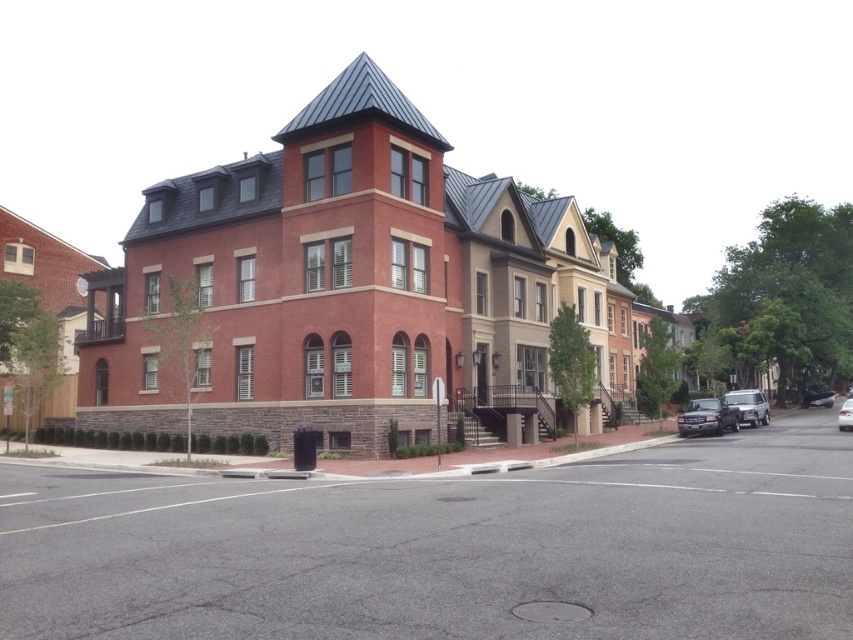
Between metallic silver suv at right and white glossy sedan at center, which one has less height?

Standing shorter between the two is white glossy sedan at center.

Which is in front, point (735, 397) or point (849, 412)?

Point (849, 412)

Locate an element on the screen. Image resolution: width=853 pixels, height=640 pixels. metallic silver suv at right is located at coordinates [x=749, y=404].

Looking at this image, is metallic silver suv at right in front of metallic silver car at right?

Yes, metallic silver suv at right is in front of metallic silver car at right.

The height and width of the screenshot is (640, 853). In order to click on metallic silver suv at right in this screenshot , I will do `click(749, 404)`.

The image size is (853, 640). Identify the location of metallic silver suv at right. (749, 404).

Is point (809, 401) behind point (844, 420)?

That is True.

Does point (819, 392) come in front of point (850, 401)?

No, it is not.

Is point (822, 394) positioned before point (840, 422)?

No, (822, 394) is behind (840, 422).

Image resolution: width=853 pixels, height=640 pixels. Find the location of `metallic silver car at right`. metallic silver car at right is located at coordinates (817, 397).